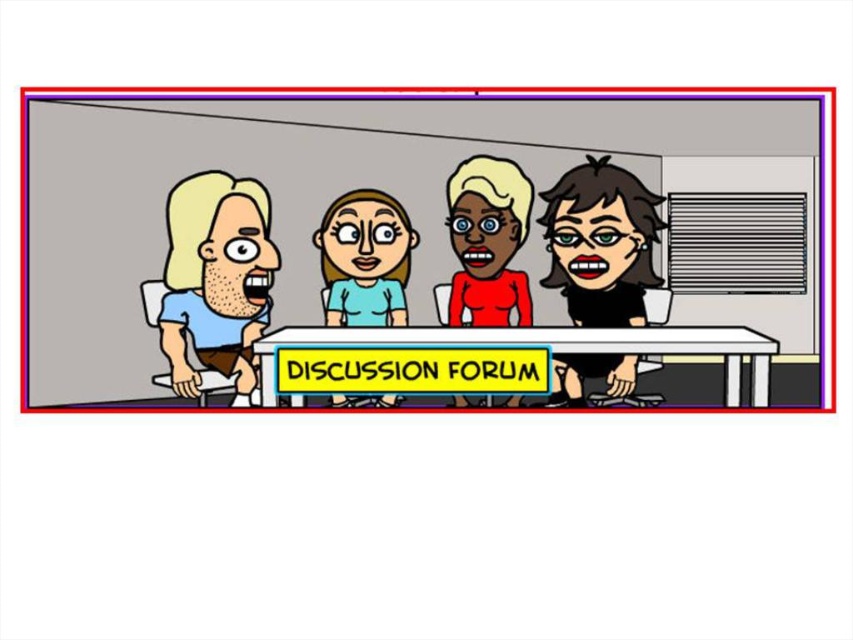
You are sitting at the table labeled DISCUSSION FORUM and want to hand a document to the person with matte black hair at center. To reach them, you need to pass by the matte black laptop at left. Is the laptop closer to you than the person?

The matte black laptop at left is further to the viewer than matte black hair at center, so the laptop is farther away from you. Therefore, the person with matte black hair at center is closer, so you can reach them without moving the laptop.

In the scene described, where is the matte blue shirt at left located in terms of coordinates?

The matte blue shirt at left is located at coordinates point (216,280).